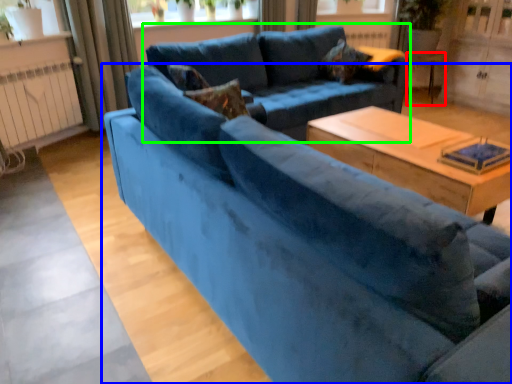
Question: Which object is positioned closest to side table (highlighted by a red box)? Select from studio couch (highlighted by a blue box) and studio couch (highlighted by a green box).

Choices:
 (A) studio couch
 (B) studio couch

Answer: (B)